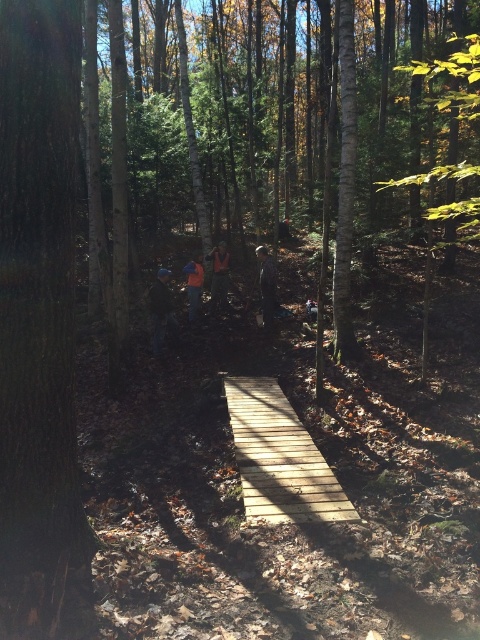
Between point (261, 280) and point (224, 289), which one is positioned behind?

The point (224, 289) is behind.

Who is lower down, camouflage jacket at center or orange fabric at center?

Positioned lower is camouflage jacket at center.

Locate an element on the screen. This screenshot has height=640, width=480. camouflage jacket at center is located at coordinates (266, 285).

Between brown rough bark at left and light brown wooden bridge at center, which one is positioned higher?

Positioned higher is brown rough bark at left.

This screenshot has height=640, width=480. I want to click on brown rough bark at left, so click(x=39, y=326).

Image resolution: width=480 pixels, height=640 pixels. I want to click on brown rough bark at left, so click(39, 326).

Between point (12, 576) and point (199, 276), which one is positioned in front?

Point (12, 576)

Who is lower down, brown rough bark at left or orange fabric jacket at center?

brown rough bark at left is below.

This screenshot has height=640, width=480. What do you see at coordinates (39, 326) in the screenshot?
I see `brown rough bark at left` at bounding box center [39, 326].

Where is `brown rough bark at left`? Image resolution: width=480 pixels, height=640 pixels. brown rough bark at left is located at coordinates (39, 326).